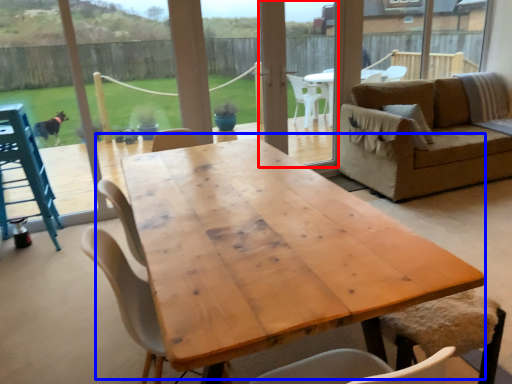
Question: Which object appears farthest to the camera in this image, screen door (highlighted by a red box) or coffee table (highlighted by a blue box)?

Choices:
 (A) screen door
 (B) coffee table

Answer: (A)